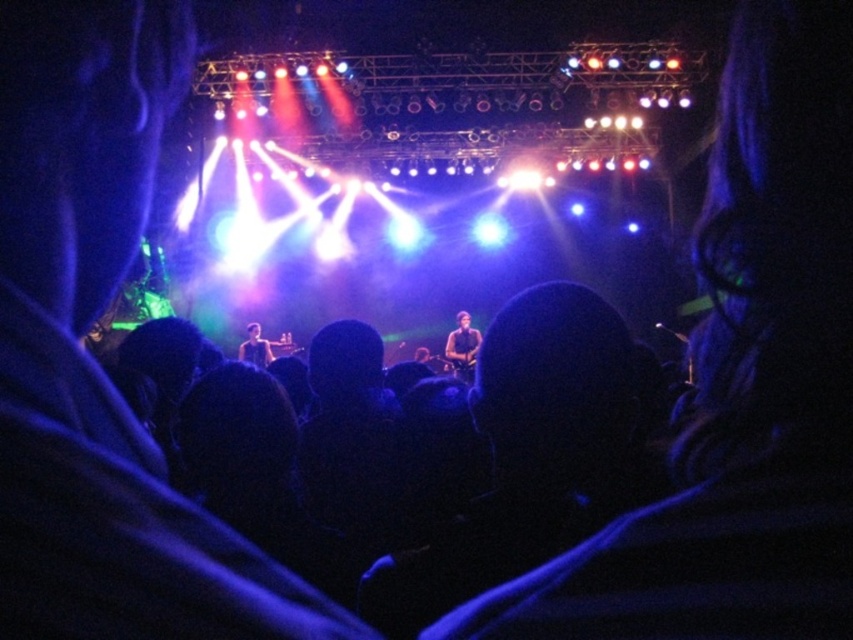
Between shiny black guitar at center and smooth skin face at center, which one is positioned higher?

shiny black guitar at center is above.

Which of these two, shiny black guitar at center or smooth skin face at center, stands shorter?

With less height is smooth skin face at center.

Who is more distant from viewer, [463,324] or [258,349]?

Point [258,349]

Where is `shiny black guitar at center`? The height and width of the screenshot is (640, 853). shiny black guitar at center is located at coordinates (462, 346).